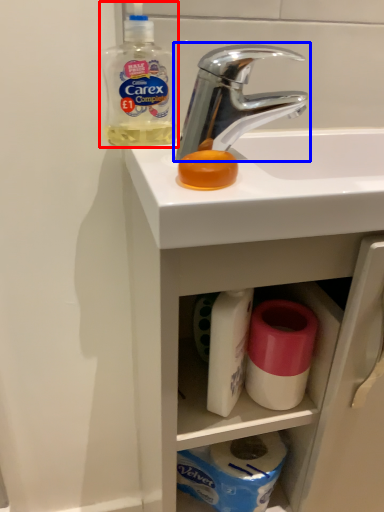
Question: Which of the following is the farthest to the observer, cleaning product (highlighted by a red box) or tap (highlighted by a blue box)?

Choices:
 (A) cleaning product
 (B) tap

Answer: (A)